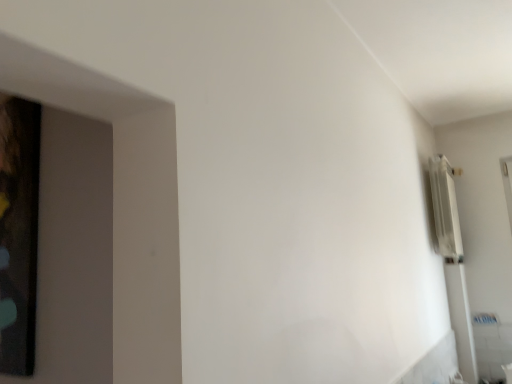
Where is `white metallic radiator at upper right`? Image resolution: width=512 pixels, height=384 pixels. white metallic radiator at upper right is located at coordinates (445, 210).

What do you see at coordinates (445, 210) in the screenshot? The image size is (512, 384). I see `white metallic radiator at upper right` at bounding box center [445, 210].

Locate an element on the screen. The height and width of the screenshot is (384, 512). wooden picture frame at left is located at coordinates (18, 233).

Image resolution: width=512 pixels, height=384 pixels. What do you see at coordinates (18, 233) in the screenshot?
I see `wooden picture frame at left` at bounding box center [18, 233].

What are the coordinates of `white metallic radiator at upper right` in the screenshot? It's located at (445, 210).

Which object is positioned more to the right, wooden picture frame at left or white metallic radiator at upper right?

From the viewer's perspective, white metallic radiator at upper right appears more on the right side.

Which object is closer to the camera, wooden picture frame at left or white metallic radiator at upper right?

wooden picture frame at left is in front.

Does point (33, 232) appear closer or farther from the camera than point (443, 206)?

Clearly, point (33, 232) is closer to the camera than point (443, 206).

From the image's perspective, is wooden picture frame at left located above or below white metallic radiator at upper right?

wooden picture frame at left is situated higher than white metallic radiator at upper right in the image.

From a real-world perspective, is wooden picture frame at left on white metallic radiator at upper right?

No.

Looking at their sizes, would you say wooden picture frame at left is wider or thinner than white metallic radiator at upper right?

Considering their sizes, wooden picture frame at left looks slimmer than white metallic radiator at upper right.

Can you confirm if wooden picture frame at left is shorter than white metallic radiator at upper right?

No, wooden picture frame at left is not shorter than white metallic radiator at upper right.

Considering the relative sizes of wooden picture frame at left and white metallic radiator at upper right in the image provided, is wooden picture frame at left smaller than white metallic radiator at upper right?

Correct, wooden picture frame at left occupies less space than white metallic radiator at upper right.

Is wooden picture frame at left outside of white metallic radiator at upper right?

Yes, wooden picture frame at left is outside of white metallic radiator at upper right.

Is wooden picture frame at left far away from white metallic radiator at upper right?

Yes, wooden picture frame at left and white metallic radiator at upper right are quite far apart.

Is wooden picture frame at left positioned with its back to white metallic radiator at upper right?

No.

How different are the orientations of wooden picture frame at left and white metallic radiator at upper right in degrees?

The angle between the facing direction of wooden picture frame at left and the facing direction of white metallic radiator at upper right is 89.3 degrees.

This screenshot has width=512, height=384. What are the coordinates of `picture frame above the white metallic radiator at upper right (from the image's perspective)` in the screenshot? It's located at (18, 233).

Which is more to the right, white metallic radiator at upper right or wooden picture frame at left?

From the viewer's perspective, white metallic radiator at upper right appears more on the right side.

Between white metallic radiator at upper right and wooden picture frame at left, which one is positioned in front?

wooden picture frame at left is in front.

Does point (455, 250) lie in front of point (25, 237)?

No, (455, 250) is behind (25, 237).

From the image's perspective, relative to wooden picture frame at left, is white metallic radiator at upper right above or below?

white metallic radiator at upper right is situated lower than wooden picture frame at left in the image.

From a real-world perspective, is white metallic radiator at upper right above or below wooden picture frame at left?

Clearly, from a real-world perspective, white metallic radiator at upper right is above wooden picture frame at left.

Which of these two, white metallic radiator at upper right or wooden picture frame at left, is wider?

white metallic radiator at upper right.

Considering the relative sizes of white metallic radiator at upper right and wooden picture frame at left in the image provided, is white metallic radiator at upper right taller than wooden picture frame at left?

No, white metallic radiator at upper right is not taller than wooden picture frame at left.

Based on their sizes in the image, would you say white metallic radiator at upper right is bigger or smaller than wooden picture frame at left?

Considering their sizes, white metallic radiator at upper right takes up more space than wooden picture frame at left.

Consider the image. Is white metallic radiator at upper right located outside wooden picture frame at left?

Indeed, white metallic radiator at upper right is completely outside wooden picture frame at left.

Based on the photo, are white metallic radiator at upper right and wooden picture frame at left making contact?

white metallic radiator at upper right and wooden picture frame at left are clearly separated.

Is white metallic radiator at upper right looking in the opposite direction of wooden picture frame at left?

No, white metallic radiator at upper right is not facing the opposite direction of wooden picture frame at left.

How different are the orientations of white metallic radiator at upper right and wooden picture frame at left in degrees?

The facing directions of white metallic radiator at upper right and wooden picture frame at left are 89.3 degrees apart.

At what (x,y) coordinates should I click in order to perform the action: click on picture frame that appears on the left of white metallic radiator at upper right. Please return your answer as a coordinate pair (x, y). This screenshot has height=384, width=512. Looking at the image, I should click on (18, 233).

Image resolution: width=512 pixels, height=384 pixels. Find the location of `picture frame in front of the white metallic radiator at upper right`. picture frame in front of the white metallic radiator at upper right is located at coordinates (18, 233).

The width and height of the screenshot is (512, 384). Identify the location of picture frame that is on the left side of white metallic radiator at upper right. (18, 233).